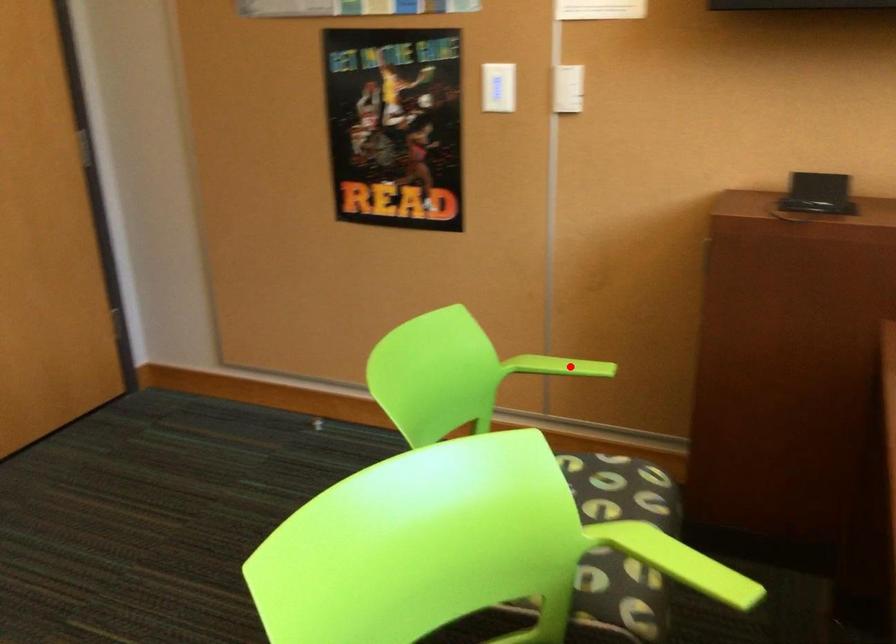
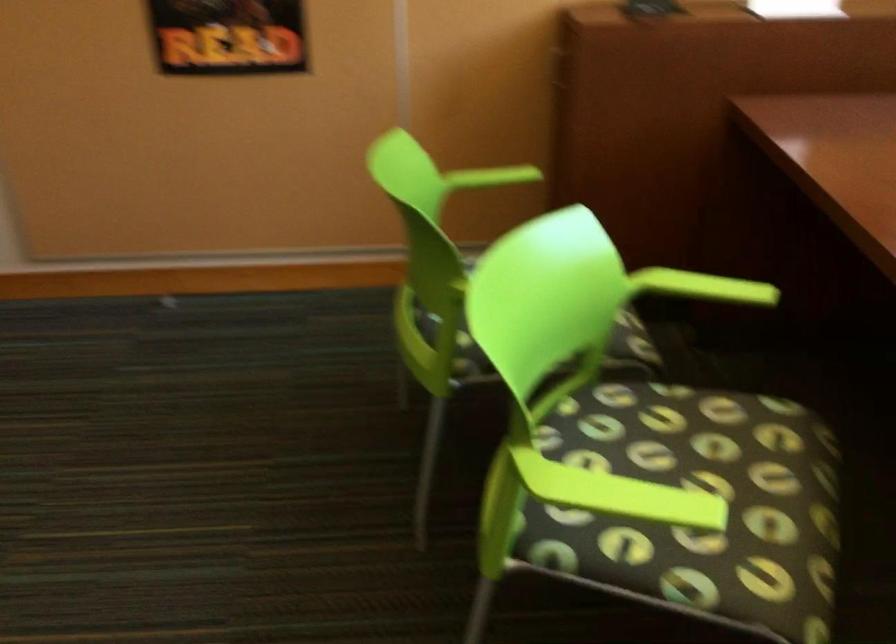
Find the pixel in the second image that matches the highlighted location in the first image.

(497, 176)